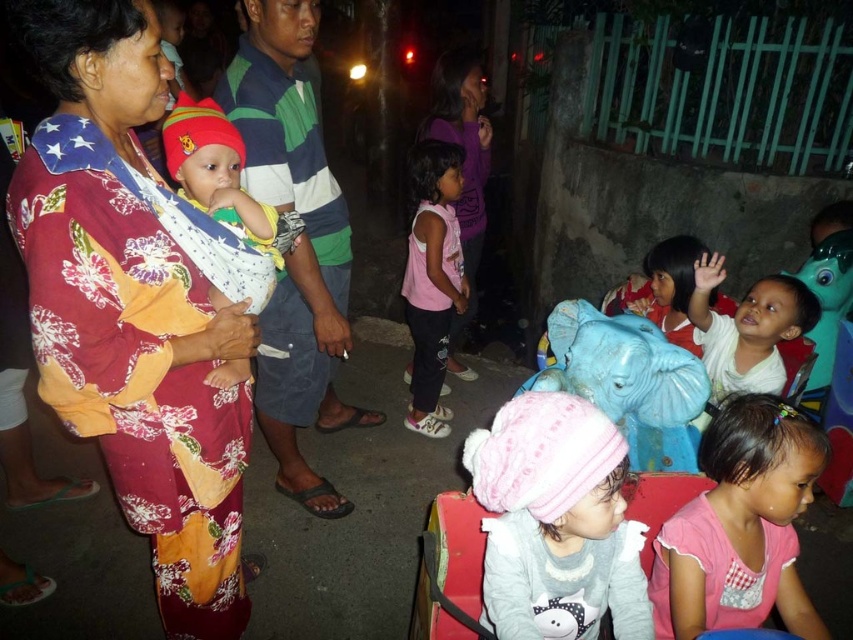
You are a photographer trying to capture a photo of the floral fabric woman at center and the pink matte shirt at center. Since you want to ensure both subjects are in focus, you need to know which one is taller. Can you determine which one is taller?

The floral fabric woman at center is taller than the pink matte shirt at center, so you should adjust your camera settings to focus on the taller subject first.

Please look at the image and locate the point at coordinates (299, 243). Which object in the scene does this point fall on?

The point at coordinates (299, 243) falls on the striped cotton shirt at center.